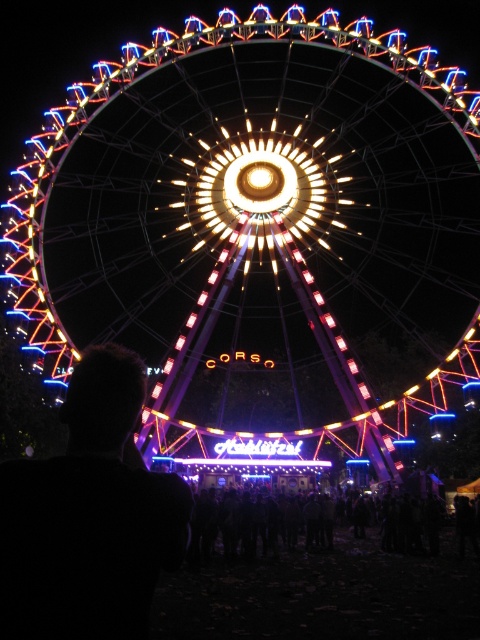
Between illuminated steel ferris wheel at center and black hair at left, which one is positioned lower?

black hair at left is below.

Is the position of illuminated steel ferris wheel at center less distant than that of black hair at left?

No, illuminated steel ferris wheel at center is further to the viewer.

Who is more forward, (117, 193) or (156, 518)?

Point (156, 518) is in front.

Locate an element on the screen. illuminated steel ferris wheel at center is located at coordinates (259, 227).

Which is more to the right, illuminated steel ferris wheel at center or black fabric crowd at lower center?

Positioned to the right is black fabric crowd at lower center.

Does illuminated steel ferris wheel at center appear under black fabric crowd at lower center?

Incorrect, illuminated steel ferris wheel at center is not positioned below black fabric crowd at lower center.

Identify the location of illuminated steel ferris wheel at center. The width and height of the screenshot is (480, 640). (259, 227).

Identify the location of illuminated steel ferris wheel at center. This screenshot has width=480, height=640. (259, 227).

Can you confirm if black hair at left is positioned to the right of black fabric crowd at lower center?

No, black hair at left is not to the right of black fabric crowd at lower center.

Between point (130, 419) and point (415, 529), which one is positioned in front?

Positioned in front is point (130, 419).

You are a GUI agent. You are given a task and a screenshot of the screen. Output one action in this format:
    pyautogui.click(x=<x>, y=<y>)
    Task: Click on the black hair at left
    The width and height of the screenshot is (480, 640).
    Given the screenshot: What is the action you would take?
    pyautogui.click(x=90, y=516)